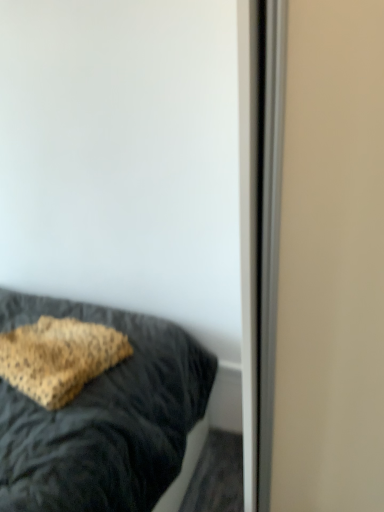
Where is `leopard print fabric pillow at lower left`? leopard print fabric pillow at lower left is located at coordinates (59, 357).

Describe the element at coordinates (59, 357) in the screenshot. I see `leopard print fabric pillow at lower left` at that location.

Describe the element at coordinates (103, 418) in the screenshot. I see `leopard print pillow at center` at that location.

The height and width of the screenshot is (512, 384). I want to click on leopard print pillow at center, so click(103, 418).

I want to click on leopard print fabric pillow at lower left, so click(59, 357).

Considering the relative positions of leopard print fabric pillow at lower left and leopard print pillow at center in the image provided, is leopard print fabric pillow at lower left to the left or to the right of leopard print pillow at center?

leopard print fabric pillow at lower left is to the right of leopard print pillow at center.

Considering their positions, is leopard print fabric pillow at lower left located in front of or behind leopard print pillow at center?

In the image, leopard print fabric pillow at lower left appears behind leopard print pillow at center.

Between point (71, 343) and point (79, 416), which one is positioned behind?

The point (71, 343) is behind.

From the image's perspective, is leopard print fabric pillow at lower left positioned above or below leopard print pillow at center?

leopard print fabric pillow at lower left is situated higher than leopard print pillow at center in the image.

From a real-world perspective, which is physically below, leopard print fabric pillow at lower left or leopard print pillow at center?

leopard print pillow at center.

Which of these two, leopard print fabric pillow at lower left or leopard print pillow at center, is thinner?

leopard print fabric pillow at lower left.

Considering the relative sizes of leopard print fabric pillow at lower left and leopard print pillow at center in the image provided, is leopard print fabric pillow at lower left shorter than leopard print pillow at center?

Correct, leopard print fabric pillow at lower left is not as tall as leopard print pillow at center.

Does leopard print fabric pillow at lower left have a larger size compared to leopard print pillow at center?

No.

Is leopard print pillow at center a part of leopard print fabric pillow at lower left?

No, leopard print pillow at center is not a part of leopard print fabric pillow at lower left.

Is leopard print fabric pillow at lower left far from leopard print pillow at center?

No, leopard print fabric pillow at lower left is not far from leopard print pillow at center.

Is leopard print fabric pillow at lower left aimed at leopard print pillow at center?

Yes, leopard print fabric pillow at lower left faces towards leopard print pillow at center.

Based on the photo, how different are the orientations of leopard print fabric pillow at lower left and leopard print pillow at center in degrees?

20.5 degrees.

Identify the location of bed in front of the leopard print fabric pillow at lower left. (103, 418).

Which object is positioned more to the left, leopard print pillow at center or leopard print fabric pillow at lower left?

Positioned to the left is leopard print pillow at center.

Is leopard print pillow at center positioned behind leopard print fabric pillow at lower left?

No, leopard print pillow at center is in front of leopard print fabric pillow at lower left.

Which is closer to the camera, (167, 328) or (50, 353)?

Clearly, point (167, 328) is more distant from the camera than point (50, 353).

From the image's perspective, which is below, leopard print pillow at center or leopard print fabric pillow at lower left?

leopard print pillow at center appears lower in the image.

From a real-world perspective, is leopard print pillow at center positioned over leopard print fabric pillow at lower left based on gravity?

No, from a real-world perspective, leopard print pillow at center is not above leopard print fabric pillow at lower left.

Considering the relative sizes of leopard print pillow at center and leopard print fabric pillow at lower left in the image provided, is leopard print pillow at center thinner than leopard print fabric pillow at lower left?

In fact, leopard print pillow at center might be wider than leopard print fabric pillow at lower left.

Considering the sizes of objects leopard print pillow at center and leopard print fabric pillow at lower left in the image provided, who is shorter, leopard print pillow at center or leopard print fabric pillow at lower left?

leopard print fabric pillow at lower left.

Looking at this image, between leopard print pillow at center and leopard print fabric pillow at lower left, which one has larger size?

With larger size is leopard print pillow at center.

Do you think leopard print pillow at center is within leopard print fabric pillow at lower left, or outside of it?

leopard print pillow at center is not inside leopard print fabric pillow at lower left, it's outside.

Is leopard print pillow at center far from leopard print fabric pillow at lower left?

No, there isn't a large distance between leopard print pillow at center and leopard print fabric pillow at lower left.

Looking at this image, is leopard print pillow at center oriented away from leopard print fabric pillow at lower left?

Yes, leopard print pillow at center is facing away from leopard print fabric pillow at lower left.

How much distance is there between leopard print pillow at center and leopard print fabric pillow at lower left?

leopard print pillow at center is 5.80 inches from leopard print fabric pillow at lower left.

What are the coordinates of `bed on the left of leopard print fabric pillow at lower left` in the screenshot? It's located at (103, 418).

What are the coordinates of `pillow located on the right of leopard print pillow at center` in the screenshot? It's located at (59, 357).

Where is `pillow that appears above the leopard print pillow at center (from the image's perspective)`? pillow that appears above the leopard print pillow at center (from the image's perspective) is located at coordinates (59, 357).